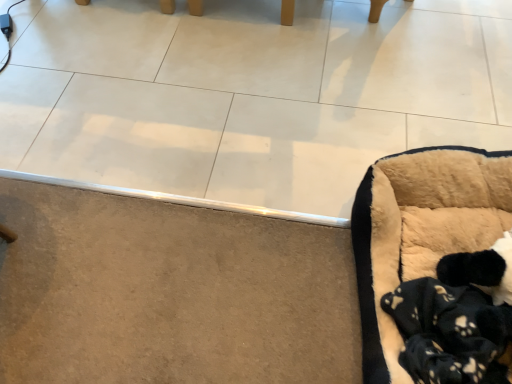
The height and width of the screenshot is (384, 512). What do you see at coordinates (420, 231) in the screenshot?
I see `beige plush dog bed at lower right` at bounding box center [420, 231].

This screenshot has width=512, height=384. Find the location of `beige plush dog bed at lower right`. beige plush dog bed at lower right is located at coordinates (420, 231).

Where is `beige plush dog bed at lower right`? The width and height of the screenshot is (512, 384). beige plush dog bed at lower right is located at coordinates (420, 231).